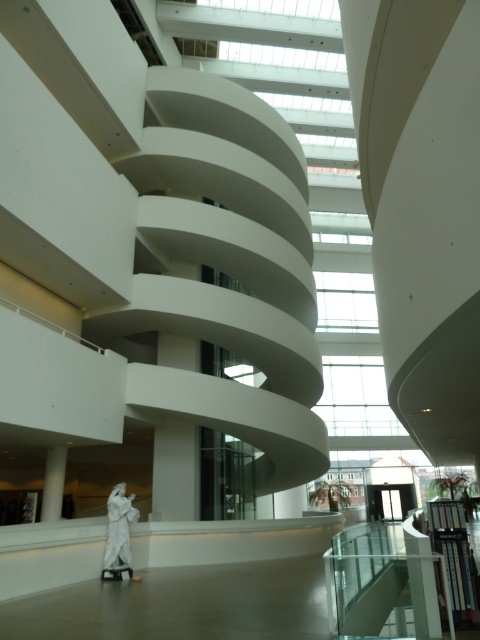
Question: Which of the following is the farthest from the observer?

Choices:
 (A) white glossy stair at lower center
 (B) white marble statue at center

Answer: (B)

Question: Can you confirm if white glossy stair at lower center is positioned above white marble statue at center?

Choices:
 (A) yes
 (B) no

Answer: (A)

Question: Which point is farther to the camera?

Choices:
 (A) (385, 604)
 (B) (135, 509)

Answer: (B)

Question: Is white glossy stair at lower center closer to the viewer compared to white marble statue at center?

Choices:
 (A) no
 (B) yes

Answer: (B)

Question: Which of the following is the closest to the observer?

Choices:
 (A) (369, 618)
 (B) (128, 499)

Answer: (A)

Question: Is white glossy stair at lower center to the right of white marble statue at center from the viewer's perspective?

Choices:
 (A) yes
 (B) no

Answer: (A)